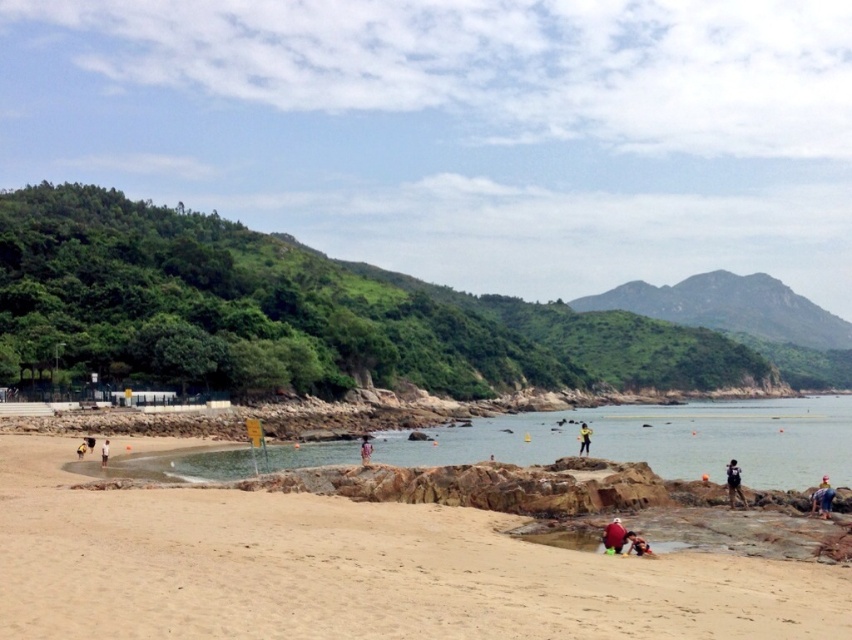
You are a GUI agent. You are given a task and a screenshot of the screen. Output one action in this format:
    pyautogui.click(x=<x>, y=<y>)
    Task: Click on the dark blue backpack at lower right
    This screenshot has height=640, width=852.
    Given the screenshot: What is the action you would take?
    pyautogui.click(x=734, y=483)

Is blue denim shorts at lower right in front of yellow fabric person at center?

That is True.

Between point (829, 490) and point (580, 424), which one is positioned behind?

The point (580, 424) is behind.

Measure the distance between blue denim shorts at lower right and camera.

blue denim shorts at lower right is 41.89 meters away from camera.

At what (x,y) coordinates should I click in order to perform the action: click on blue denim shorts at lower right. Please return your answer as a coordinate pair (x, y). Looking at the image, I should click on (822, 499).

Can you confirm if dark blue backpack at lower right is positioned above white cotton shirt at lower left?

Actually, dark blue backpack at lower right is below white cotton shirt at lower left.

Which is more to the right, dark blue backpack at lower right or white cotton shirt at lower left?

Positioned to the right is dark blue backpack at lower right.

Between point (735, 484) and point (106, 461), which one is positioned in front?

Positioned in front is point (735, 484).

Where is `dark blue backpack at lower right`? dark blue backpack at lower right is located at coordinates [x=734, y=483].